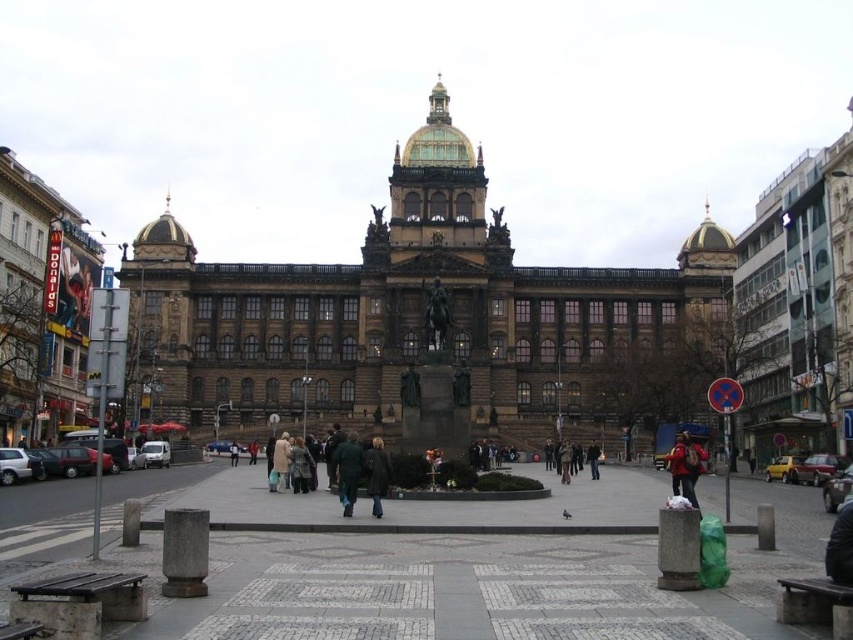
Question: Can you confirm if red fabric backpack at lower right is bigger than dark green jacket at center?

Choices:
 (A) no
 (B) yes

Answer: (B)

Question: Is red fabric backpack at lower right wider than dark green jacket at center?

Choices:
 (A) yes
 (B) no

Answer: (A)

Question: Is dark green jacket at center smaller than dark brown leather coat at center?

Choices:
 (A) yes
 (B) no

Answer: (B)

Question: Which point appears closest to the camera in this image?

Choices:
 (A) (688, 483)
 (B) (380, 486)
 (C) (341, 484)

Answer: (B)

Question: Among these objects, which one is farthest from the camera?

Choices:
 (A) dark brown leather coat at center
 (B) dark green jacket at center
 (C) red fabric backpack at lower right

Answer: (C)

Question: Which of the following is the farthest from the observer?

Choices:
 (A) dark green jacket at center
 (B) red fabric backpack at lower right

Answer: (B)